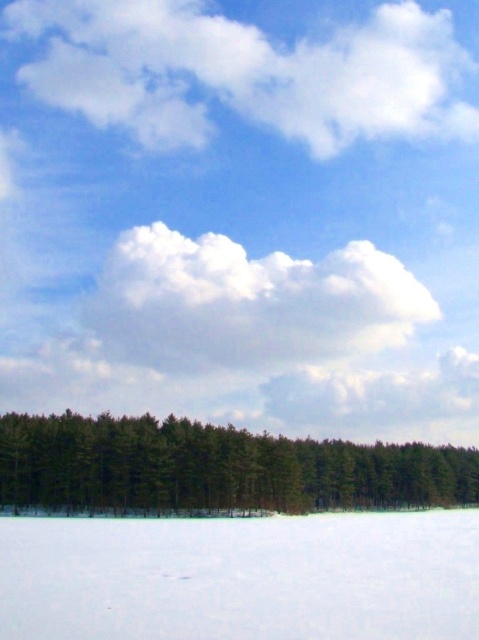
You are an artist planning to paint the winter landscape. You want to ensure the white fluffy cloud at upper center and the green matte trees at lower center are proportionally accurate. Which object should you paint larger?

The white fluffy cloud at upper center should be painted larger because it is bigger than the green matte trees at lower center according to the description.

You are an observer looking at the winter landscape. You notice the white fluffy cloud at upper center and the green matte trees at lower center. Which object is closer to you?

The white fluffy cloud at upper center is closer to you because it is further to the viewer than the green matte trees at lower center.